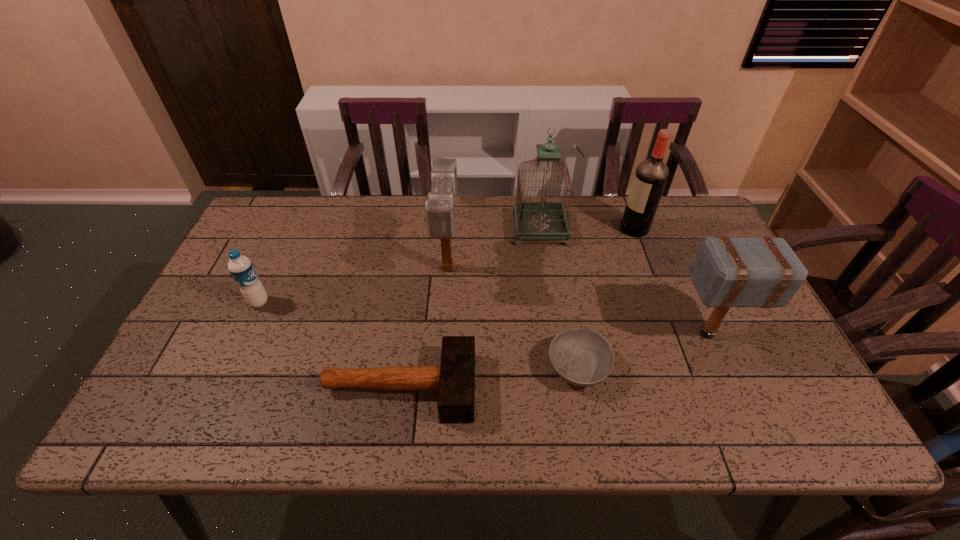
Find the location of `vacant space located 0.300m at the door of the birdcage`. vacant space located 0.300m at the door of the birdcage is located at coordinates (420, 229).

You are a GUI agent. You are given a task and a screenshot of the screen. Output one action in this format:
    pyautogui.click(x=<x>, y=<y>)
    Task: Click on the vacant space located 0.230m on the front-facing side of the liquor
    Image resolution: width=960 pixels, height=540 pixels.
    Given the screenshot: What is the action you would take?
    pyautogui.click(x=548, y=229)

Where is `vacant region located on the front-facing side of the liquor`? This screenshot has height=540, width=960. vacant region located on the front-facing side of the liquor is located at coordinates (586, 229).

The width and height of the screenshot is (960, 540). I want to click on free region located 0.180m on the front-facing side of the liquor, so click(564, 229).

The image size is (960, 540). In order to click on vacant space located 0.180m on the left of the farthest mallet in this screenshot , I will do `click(375, 267)`.

You are a GUI agent. You are given a task and a screenshot of the screen. Output one action in this format:
    pyautogui.click(x=<x>, y=<y>)
    Task: Click on the free location located on the striking surface of the rightmost mallet
    
    Given the screenshot: What is the action you would take?
    pyautogui.click(x=561, y=334)

Locate an element on the screen. This screenshot has height=540, width=960. blank area located 0.290m on the striking surface of the rightmost mallet is located at coordinates (557, 334).

Locate an element on the screen. Image resolution: width=960 pixels, height=540 pixels. vacant region located on the striking surface of the rightmost mallet is located at coordinates (552, 334).

The width and height of the screenshot is (960, 540). I want to click on free location located on the label of the fifth tallest object, so click(402, 302).

What are the coordinates of `vacant space located on the hammer head face of the shortest mallet` in the screenshot? It's located at (544, 387).